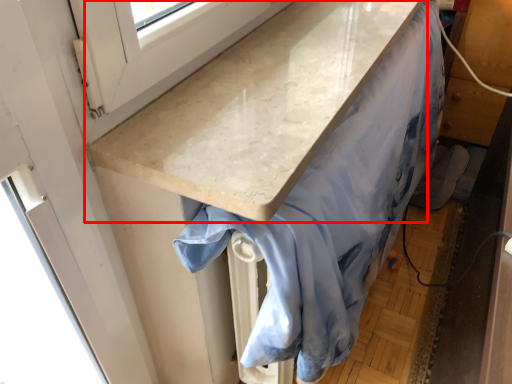
Question: From the image's perspective, where is countertop (annotated by the red box) located relative to fabric?

Choices:
 (A) above
 (B) below

Answer: (A)